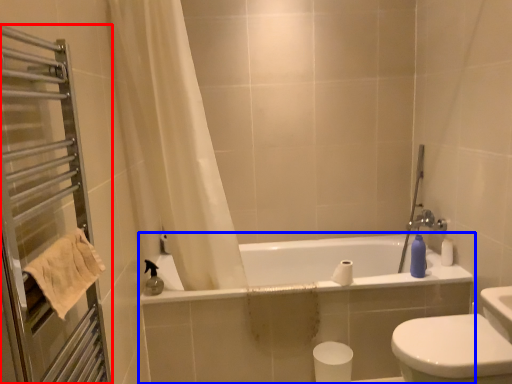
Question: Among these objects, which one is nearest to the camera, screen door (highlighted by a red box) or bathtub (highlighted by a blue box)?

Choices:
 (A) screen door
 (B) bathtub

Answer: (A)